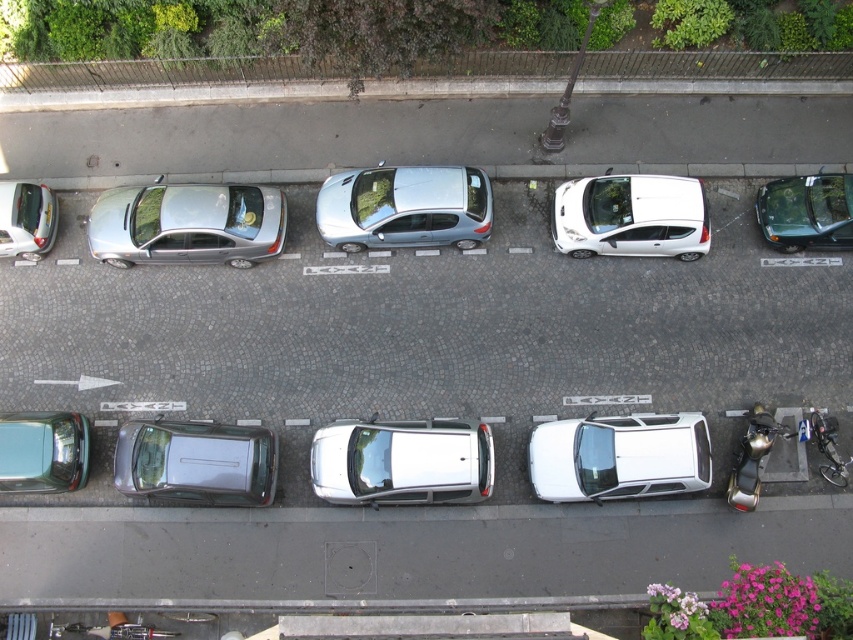
Question: Which of the following is the farthest from the observer?

Choices:
 (A) (15, 460)
 (B) (192, 234)
 (C) (212, 490)
 (D) (651, 417)

Answer: (B)

Question: Does satin silver car at center have a lesser width compared to shiny metallic motorcycle at lower right?

Choices:
 (A) no
 (B) yes

Answer: (A)

Question: Which point is closer to the camera?

Choices:
 (A) white glossy car at center
 (B) shiny silver car at left

Answer: (A)

Question: From the image, what is the correct spatial relationship of white glossy car at center in relation to satin silver car at center?

Choices:
 (A) above
 (B) below

Answer: (B)

Question: Is satin silver car at left bigger than shiny silver car at left?

Choices:
 (A) no
 (B) yes

Answer: (B)

Question: Among these points, which one is farthest from the camera?

Choices:
 (A) (57, 424)
 (B) (646, 433)
 (C) (784, 220)
 (D) (447, 172)

Answer: (C)